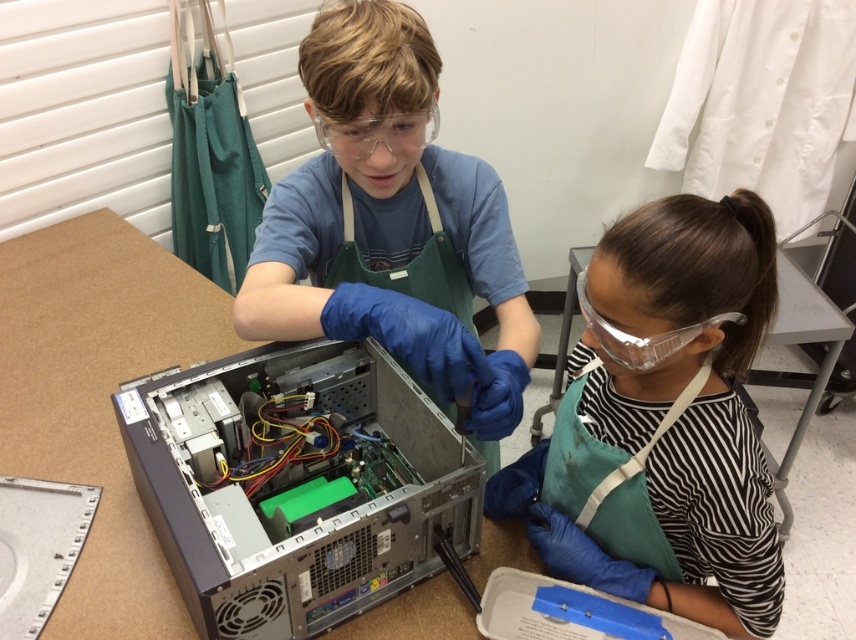
Question: Can you confirm if clear plastic goggles at center is smaller than clear plastic goggles at upper center?

Choices:
 (A) no
 (B) yes

Answer: (B)

Question: Which point appears farthest from the camera in this image?

Choices:
 (A) (408, 131)
 (B) (367, 214)
 (C) (681, 333)

Answer: (B)

Question: Is the position of silver metallic computer case at center less distant than that of matte blue shirt at center?

Choices:
 (A) no
 (B) yes

Answer: (B)

Question: Does silver metallic computer case at center lie behind matte blue shirt at center?

Choices:
 (A) no
 (B) yes

Answer: (A)

Question: Which point appears farthest from the camera in this image?

Choices:
 (A) (379, 122)
 (B) (328, 124)
 (C) (721, 316)

Answer: (B)

Question: Which object is farther from the camera taking this photo?

Choices:
 (A) green apron at lower right
 (B) matte blue shirt at center
 (C) clear plastic goggles at center
 (D) silver metallic computer case at center

Answer: (C)